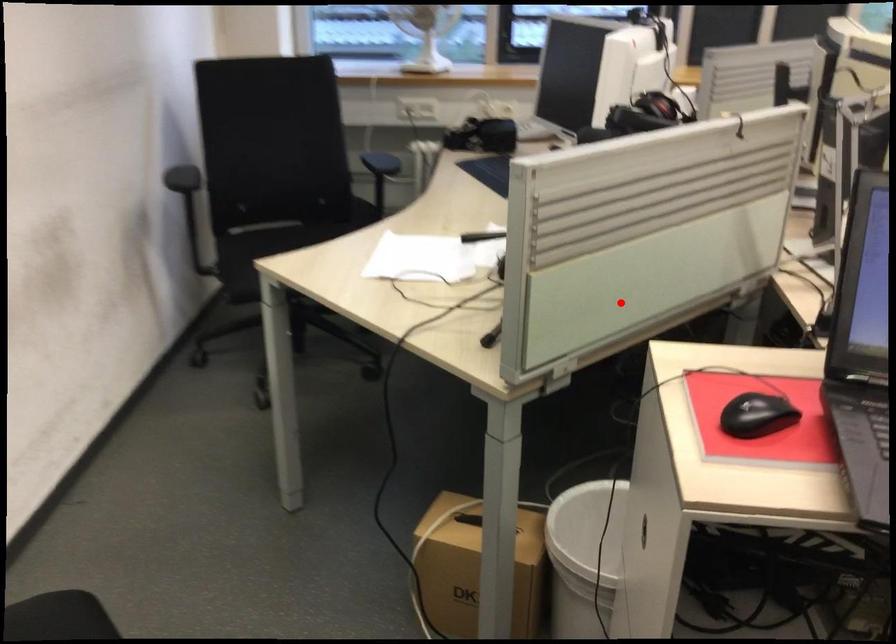
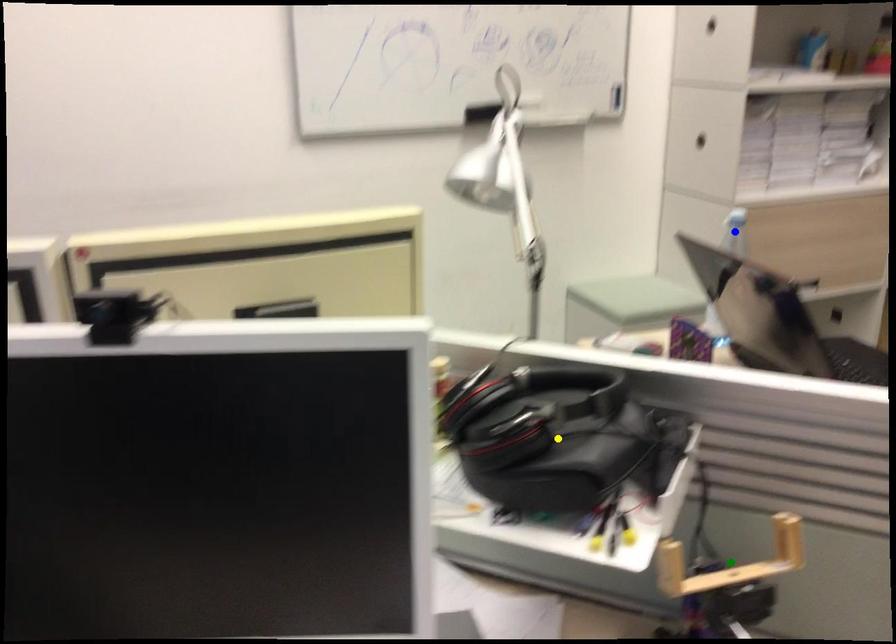
Question: I am providing you with two images of the same scene from different viewpoints. A red point is marked on the first image. You are given multiple points on the second image. Which mark in image 2 goes with the point in image 1?

Choices:
 (A) yellow point
 (B) blue point
 (C) green point

Answer: (C)